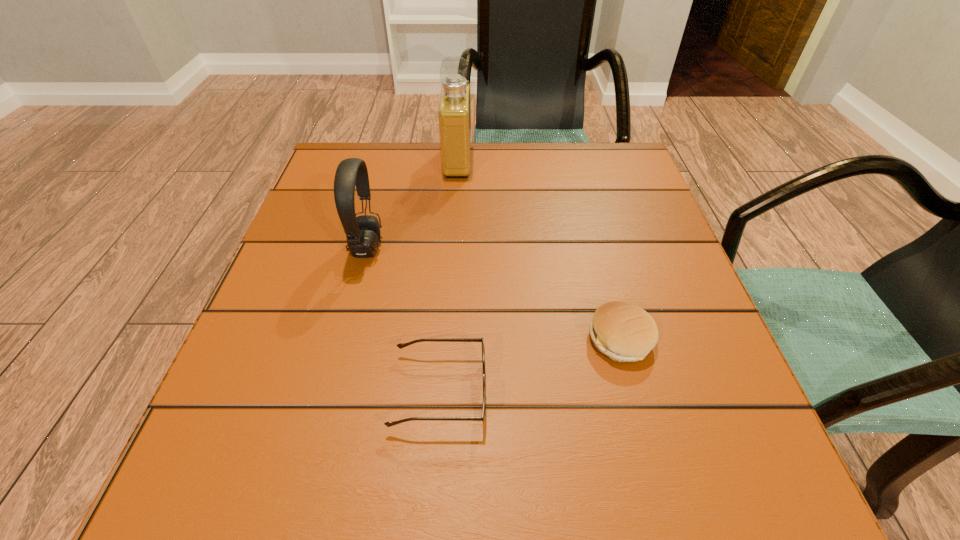
Where is `the third closest object to the third nearest object`? Image resolution: width=960 pixels, height=540 pixels. the third closest object to the third nearest object is located at coordinates (624, 332).

At what (x,y) coordinates should I click in order to perform the action: click on the second closest object to the patty. Please return your answer as a coordinate pair (x, y). The image size is (960, 540). Looking at the image, I should click on (363, 235).

The image size is (960, 540). What are the coordinates of `vacant region that satisfies the following two spatial constraints: 1. on the front-facing side of the rightmost object; 2. on the right side of the perfume` in the screenshot? It's located at (445, 339).

At what (x,y) coordinates should I click in order to perform the action: click on vacant space that satisfies the following two spatial constraints: 1. on the front-facing side of the farthest object; 2. on the left side of the rightmost object. Please return your answer as a coordinate pair (x, y). This screenshot has width=960, height=540. Looking at the image, I should click on (445, 339).

What are the coordinates of `blank area in the image that satisfies the following two spatial constraints: 1. on the front-facing side of the farthest object; 2. on the right side of the patty` in the screenshot? It's located at (445, 339).

The height and width of the screenshot is (540, 960). Find the location of `vacant space that satisfies the following two spatial constraints: 1. on the front-facing side of the third nearest object; 2. on the left side of the rightmost object`. vacant space that satisfies the following two spatial constraints: 1. on the front-facing side of the third nearest object; 2. on the left side of the rightmost object is located at coordinates (343, 339).

Locate an element on the screen. The image size is (960, 540). vacant area in the image that satisfies the following two spatial constraints: 1. on the front-facing side of the tallest object; 2. on the left side of the patty is located at coordinates (445, 339).

This screenshot has height=540, width=960. Identify the location of free space that satisfies the following two spatial constraints: 1. on the front-facing side of the third tallest object; 2. on the left side of the second tallest object. (343, 339).